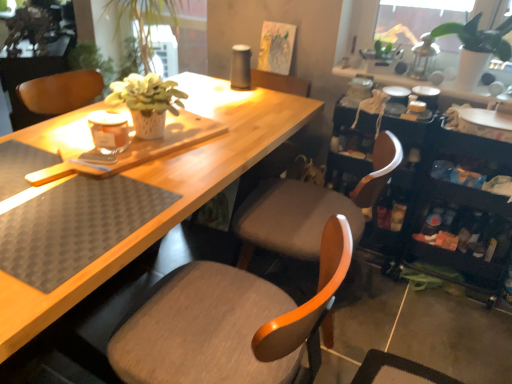
Question: In which direction should I rotate to look at matte gray chair at center, marked as the first chair in a front-to-back arrangement?

Choices:
 (A) left
 (B) right

Answer: (A)

Question: Which direction should I rotate to look at matte gray chair at center, which is the first chair in back-to-front order, — up or down?

Choices:
 (A) down
 (B) up

Answer: (A)

Question: Does matte gray chair at center, the 2th chair from the front, turn towards white matte plant pot at upper right?

Choices:
 (A) yes
 (B) no

Answer: (B)

Question: From the image's perspective, is matte gray chair at center, which is the first chair in back-to-front order, over white matte plant pot at upper right?

Choices:
 (A) yes
 (B) no

Answer: (B)

Question: Is matte gray chair at center, which is the first chair in back-to-front order, turned away from white matte plant pot at upper right?

Choices:
 (A) yes
 (B) no

Answer: (B)

Question: Considering the relative positions of matte gray chair at center, the 2th chair from the front, and white matte plant pot at upper right in the image provided, is matte gray chair at center, the 2th chair from the front, to the right of white matte plant pot at upper right from the viewer's perspective?

Choices:
 (A) no
 (B) yes

Answer: (A)

Question: From a real-world perspective, is matte gray chair at center, which is the first chair in back-to-front order, located higher than white matte plant pot at upper right?

Choices:
 (A) no
 (B) yes

Answer: (A)

Question: Would you say white matte plant pot at upper right is part of matte gray chair at center, the 2th chair from the front,'s contents?

Choices:
 (A) yes
 (B) no

Answer: (B)

Question: Does black rubber placemat at lower left have a greater height compared to matte gray chair at center, placed as the 2th chair when sorted from back to front?

Choices:
 (A) no
 (B) yes

Answer: (A)

Question: Does black rubber placemat at lower left have a greater width compared to matte gray chair at center, marked as the first chair in a front-to-back arrangement?

Choices:
 (A) no
 (B) yes

Answer: (A)

Question: From a real-world perspective, is black rubber placemat at lower left positioned over matte gray chair at center, marked as the first chair in a front-to-back arrangement, based on gravity?

Choices:
 (A) yes
 (B) no

Answer: (A)

Question: Can you confirm if black rubber placemat at lower left is positioned to the right of matte gray chair at center, placed as the 2th chair when sorted from back to front?

Choices:
 (A) yes
 (B) no

Answer: (B)

Question: Considering the relative positions of black rubber placemat at lower left and matte gray chair at center, placed as the 2th chair when sorted from back to front, in the image provided, is black rubber placemat at lower left to the left of matte gray chair at center, placed as the 2th chair when sorted from back to front, from the viewer's perspective?

Choices:
 (A) no
 (B) yes

Answer: (B)

Question: Would you consider black rubber placemat at lower left to be distant from matte gray chair at center, marked as the first chair in a front-to-back arrangement?

Choices:
 (A) yes
 (B) no

Answer: (B)

Question: Could matte gray chair at center, the 2th chair from the front, be considered to be inside matte gray chair at center, placed as the 2th chair when sorted from back to front?

Choices:
 (A) yes
 (B) no

Answer: (B)